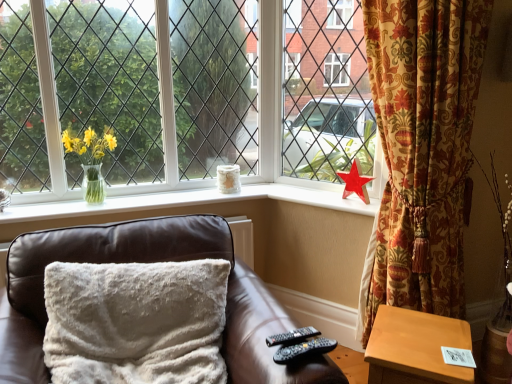
Question: Is brown leather couch at center spatially inside black plastic remote at lower right, which appears as the 2th remote when viewed from the front, or outside of it?

Choices:
 (A) inside
 (B) outside

Answer: (B)

Question: Considering their positions, is brown leather couch at center located in front of or behind black plastic remote at lower right, the 1th remote in the back-to-front sequence?

Choices:
 (A) front
 (B) behind

Answer: (A)

Question: Considering the real-world distances, which object is closest to the red plastic star at right?

Choices:
 (A) brown leather couch at center
 (B) yellow glass vase at left, placed as the first daffodil when sorted from left to right
 (C) black plastic remote at lower center, the 2th remote from the back
 (D) gold floral curtain at right
 (E) matte glass vase at upper center, acting as the 2th daffodil starting from the left

Answer: (E)

Question: Estimate the real-world distances between objects in this image. Which object is farther from the clear glass vase at left?

Choices:
 (A) light brown wooden table at lower right
 (B) black plastic remote at lower center, the 2th remote from the back
 (C) black plastic remote at lower right, the 1th remote in the back-to-front sequence
 (D) red plastic star at right
 (E) white glossy vase at upper center

Answer: (B)